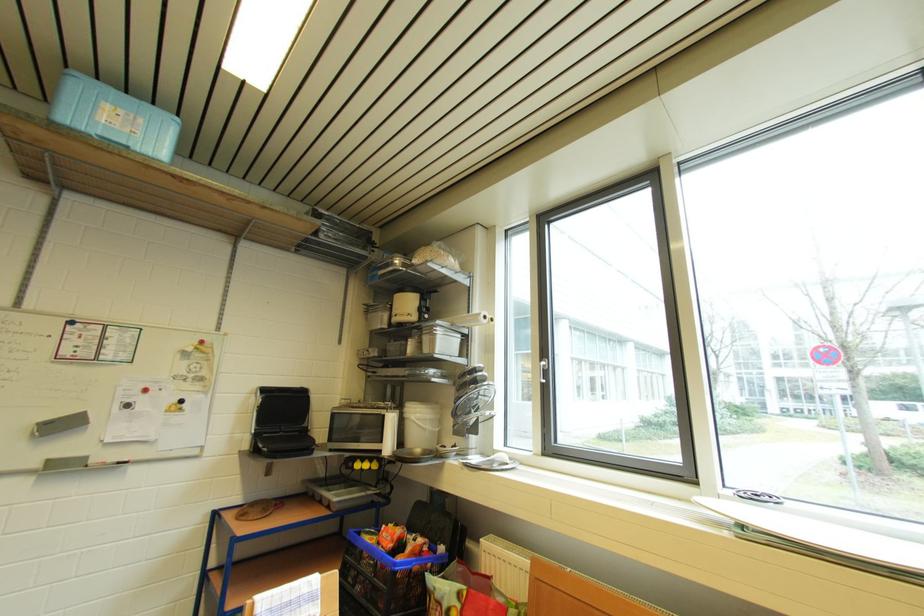
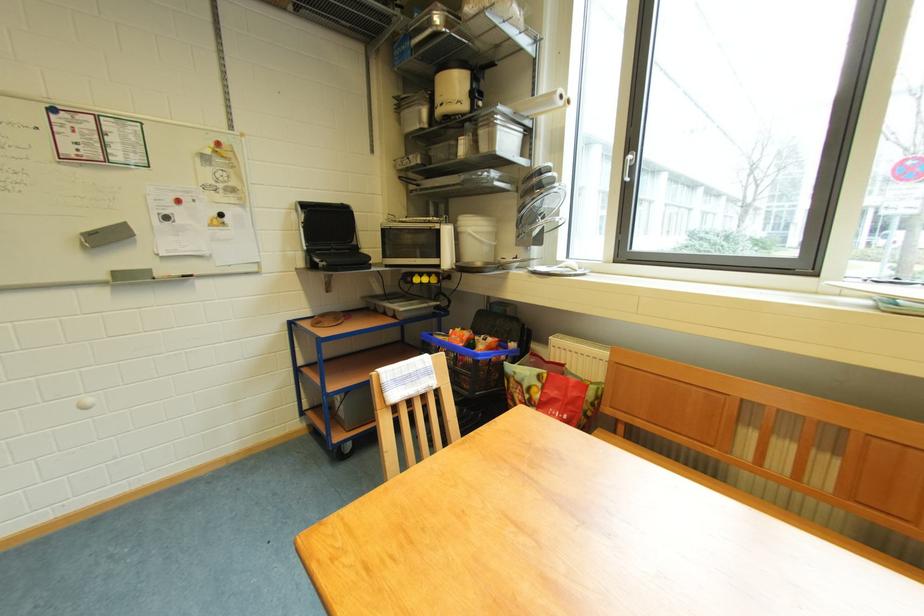
Find the pixel in the second image that matches pixel 373 469 in the first image.

(432, 283)